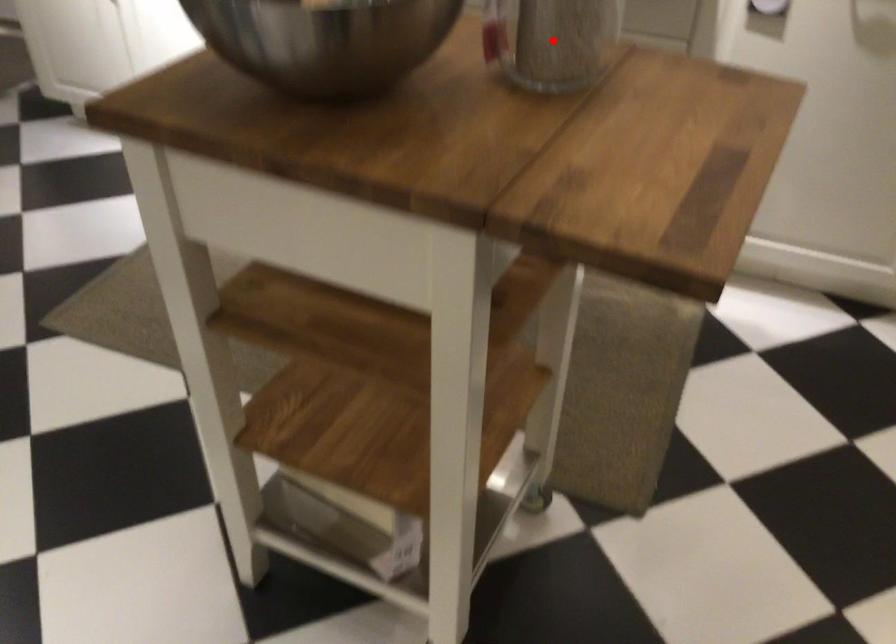
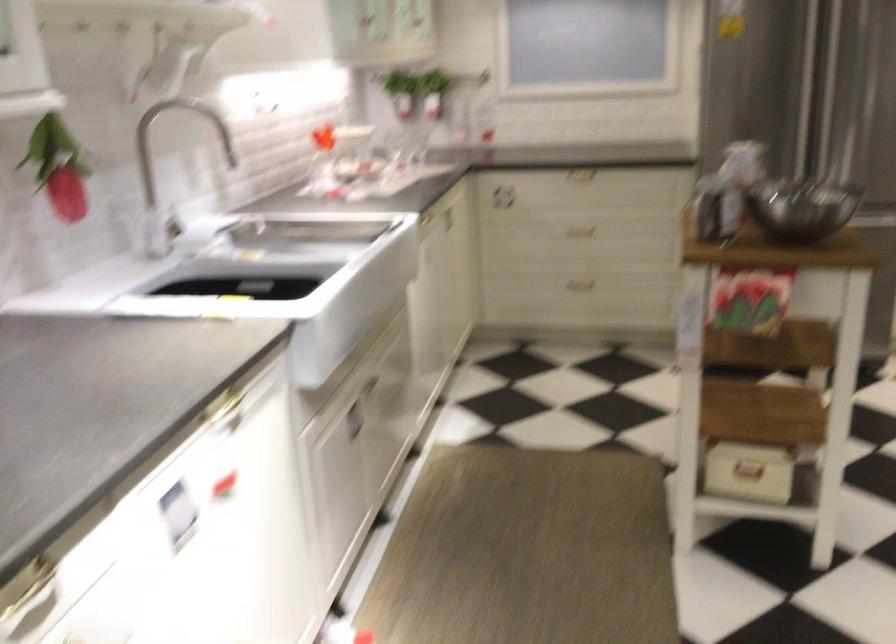
Question: I am providing you with two images of the same scene from different viewpoints. A red point is marked on the first image. Can you still see the location of the red point in image 2?

Choices:
 (A) Yes
 (B) No

Answer: (B)